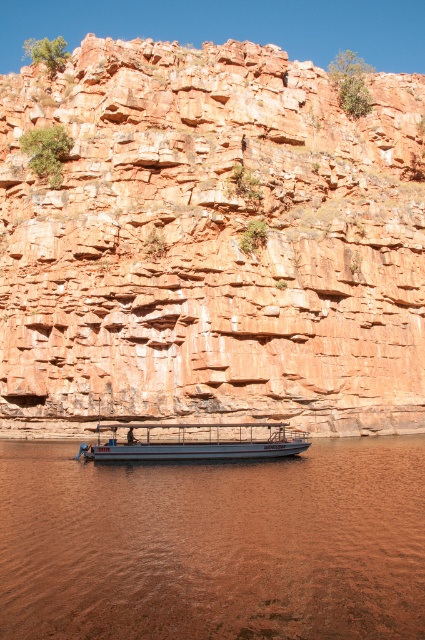
Can you confirm if matte orange rock at center is wider than brown matte water at lower center?

Indeed, matte orange rock at center has a greater width compared to brown matte water at lower center.

The height and width of the screenshot is (640, 425). What do you see at coordinates (210, 243) in the screenshot?
I see `matte orange rock at center` at bounding box center [210, 243].

Who is more forward, (418, 301) or (322, 576)?

Positioned in front is point (322, 576).

This screenshot has height=640, width=425. In order to click on matte orange rock at center in this screenshot , I will do `click(210, 243)`.

Measure the distance between brown matte water at lower center and metallic gray boat at center.

A distance of 32.38 feet exists between brown matte water at lower center and metallic gray boat at center.

Who is more forward, [257,476] or [226,456]?

Point [257,476] is more forward.

In order to click on brown matte water at lower center in this screenshot , I will do `click(215, 545)`.

Locate an element on the screen. The height and width of the screenshot is (640, 425). matte orange rock at center is located at coordinates (210, 243).

Which is more to the right, matte orange rock at center or metallic gray boat at center?

matte orange rock at center is more to the right.

This screenshot has width=425, height=640. Identify the location of matte orange rock at center. (210, 243).